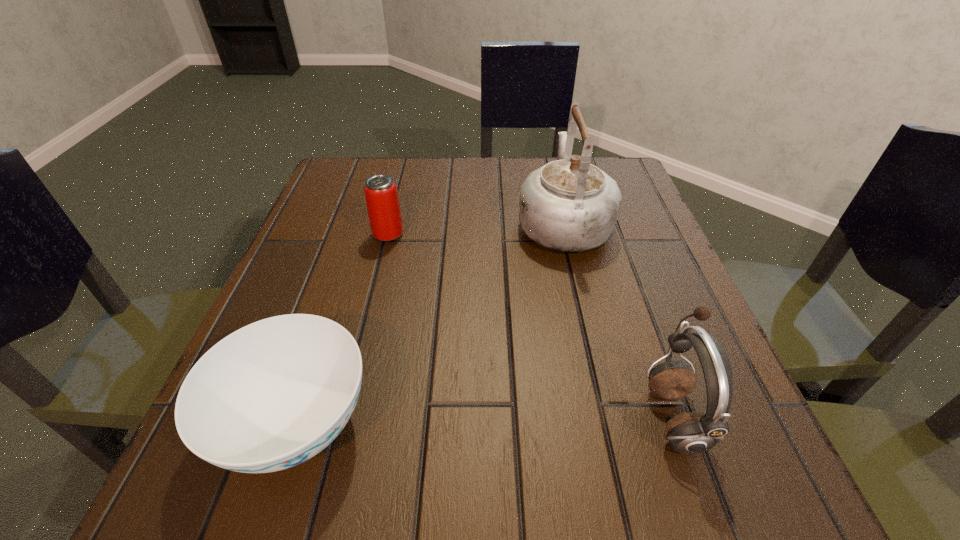
Find the location of `free spot between the kettle and the beer can`. free spot between the kettle and the beer can is located at coordinates (476, 228).

The width and height of the screenshot is (960, 540). In order to click on free point between the earphone and the beer can in this screenshot , I will do `click(531, 325)`.

At what (x,y) coordinates should I click in order to perform the action: click on blank region between the beer can and the third shortest object. Please return your answer as a coordinate pair (x, y). The height and width of the screenshot is (540, 960). Looking at the image, I should click on (531, 325).

Where is `free space between the kettle and the earphone`? free space between the kettle and the earphone is located at coordinates (618, 319).

Identify the location of free area in between the earphone and the kettle. (618, 319).

The image size is (960, 540). I want to click on vacant space in between the earphone and the chinaware, so click(x=485, y=420).

Where is `object that is the second closest to the earphone`? object that is the second closest to the earphone is located at coordinates (271, 395).

The image size is (960, 540). In order to click on object that stands as the closest to the tallest object in this screenshot , I will do `click(381, 195)`.

The height and width of the screenshot is (540, 960). I want to click on blank area in the image that satisfies the following two spatial constraints: 1. on the ear pads of the earphone; 2. on the front side of the shortest object, so click(677, 425).

The image size is (960, 540). I want to click on vacant space that satisfies the following two spatial constraints: 1. on the back side of the chinaware; 2. on the right side of the beer can, so click(359, 234).